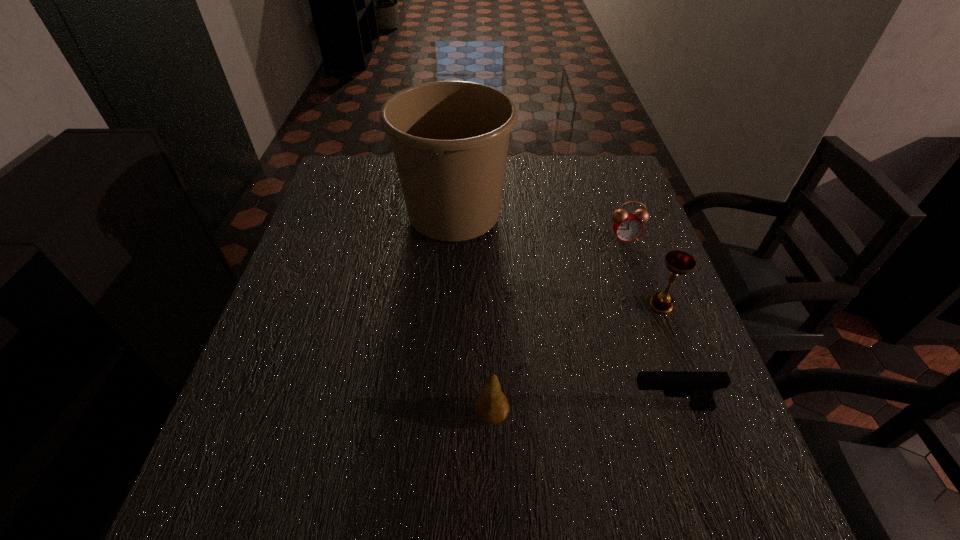
Find the location of `bucket`. bucket is located at coordinates (450, 139).

This screenshot has width=960, height=540. Identify the location of the second tallest object. (678, 262).

Locate an element on the screen. The height and width of the screenshot is (540, 960). chalice is located at coordinates (678, 262).

The width and height of the screenshot is (960, 540). Find the location of `alarm clock`. alarm clock is located at coordinates (627, 226).

Identify the location of pear. (491, 406).

This screenshot has height=540, width=960. Find the location of `pistol`. pistol is located at coordinates (700, 386).

Identify the location of free space located 0.370m on the front of the bucket. The height and width of the screenshot is (540, 960). (444, 382).

You are a GUI agent. You are given a task and a screenshot of the screen. Output one action in this format:
    pyautogui.click(x=<x>, y=<y>)
    Task: Click on the free region located 0.390m on the back of the third farthest object
    
    Given the screenshot: What is the action you would take?
    pyautogui.click(x=620, y=195)

At what (x,y) coordinates should I click in order to perform the action: click on free space located 0.360m on the clock face of the alarm clock. Please return your answer as a coordinate pair (x, y). Looking at the image, I should click on (667, 361).

Where is `vacant space located on the back of the pear`? vacant space located on the back of the pear is located at coordinates (490, 334).